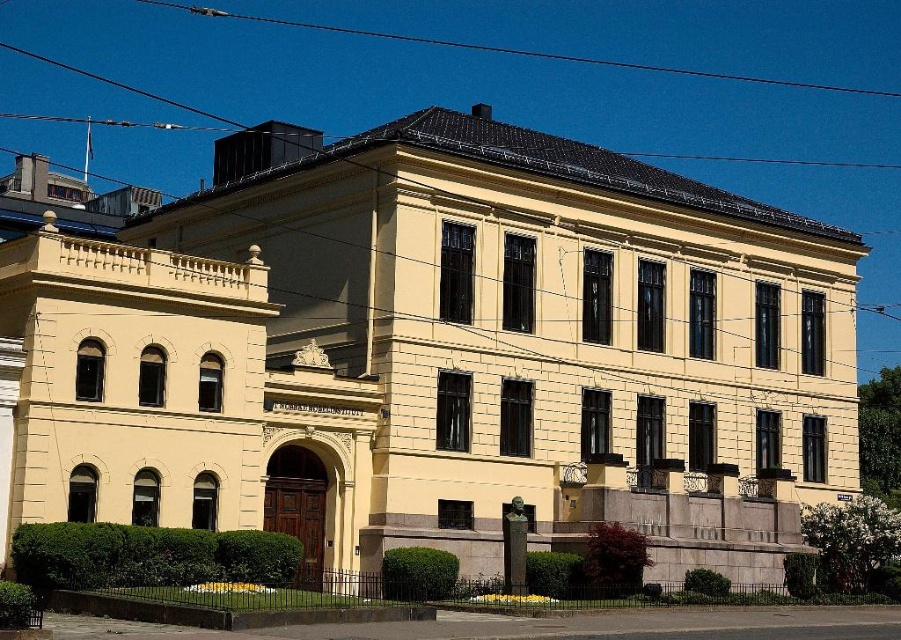
Question: Among these objects, which one is farthest from the camera?

Choices:
 (A) bronze statue at center
 (B) black wire at upper center

Answer: (B)

Question: Can you confirm if black wire at upper center is wider than bronze statue at center?

Choices:
 (A) yes
 (B) no

Answer: (A)

Question: Does black wire at upper center have a larger size compared to bronze statue at center?

Choices:
 (A) no
 (B) yes

Answer: (B)

Question: Which point is farther to the camera?

Choices:
 (A) [478, 45]
 (B) [526, 532]

Answer: (A)

Question: Is black wire at upper center wider than bronze statue at center?

Choices:
 (A) no
 (B) yes

Answer: (B)